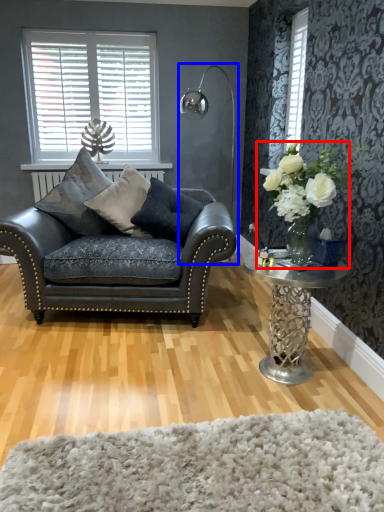
Question: Among these objects, which one is nearest to the camera, floral arrangement (highlighted by a red box) or lamp (highlighted by a blue box)?

Choices:
 (A) floral arrangement
 (B) lamp

Answer: (A)